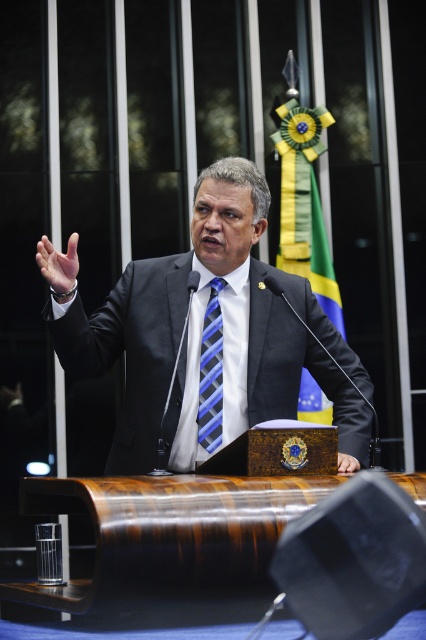
Does blue striped tie at center have a smaller size compared to smooth skin hand at center?

No, blue striped tie at center is not smaller than smooth skin hand at center.

Can you confirm if blue striped tie at center is taller than smooth skin hand at center?

Yes, blue striped tie at center is taller than smooth skin hand at center.

In order to click on blue striped tie at center in this screenshot , I will do `click(210, 372)`.

Based on the photo, how distant is black suit at center from matte blue tie at center?

They are 23.19 inches apart.

Is black suit at center positioned in front of matte blue tie at center?

No, it is behind matte blue tie at center.

Does point (278, 406) come behind point (58, 268)?

Yes, point (278, 406) is behind point (58, 268).

Identify the location of black suit at center. This screenshot has width=426, height=640. (210, 337).

Is black suit at center bigger than blue striped tie at center?

Indeed, black suit at center has a larger size compared to blue striped tie at center.

Does point (206, 177) come closer to viewer compared to point (213, 284)?

Yes, it is.

This screenshot has height=640, width=426. I want to click on black suit at center, so click(x=210, y=337).